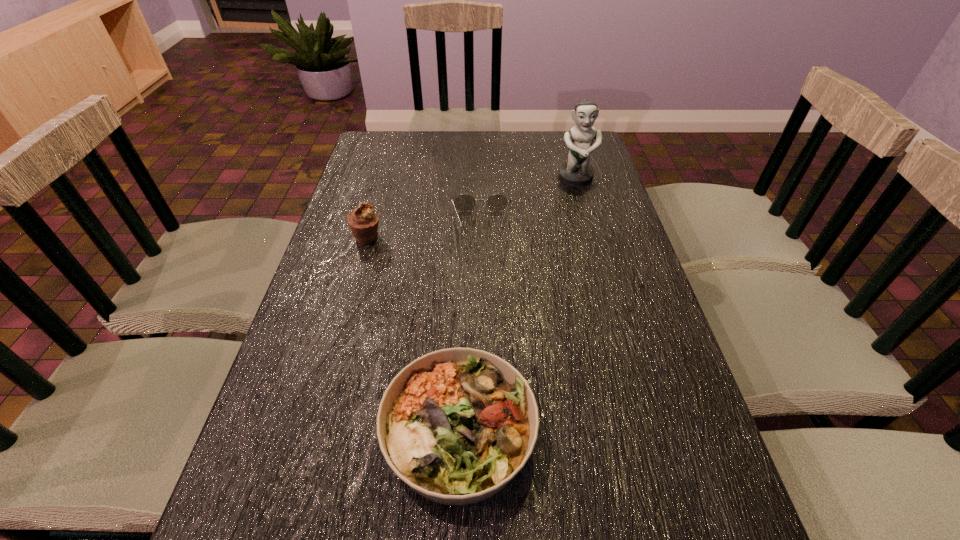
Locate an element on the screen. the farthest object is located at coordinates (577, 172).

The image size is (960, 540). I want to click on the rightmost object, so click(x=577, y=172).

At what (x,y) coordinates should I click in order to perform the action: click on the leftmost object. Please return your answer as a coordinate pair (x, y). The width and height of the screenshot is (960, 540). Looking at the image, I should click on tap(363, 221).

The image size is (960, 540). I want to click on muffin, so click(x=363, y=221).

Where is `salad plate`? The width and height of the screenshot is (960, 540). salad plate is located at coordinates (457, 424).

Where is `the second shortest object`? The image size is (960, 540). the second shortest object is located at coordinates (457, 424).

Locate an element on the screen. the shortest object is located at coordinates (497, 202).

Find the location of a particular element. free region located on the front-facing side of the rightmost object is located at coordinates (591, 233).

The height and width of the screenshot is (540, 960). Identify the location of vacant space located 0.050m on the right of the third shortest object. (400, 237).

I want to click on vacant space located 0.220m on the right of the salad plate, so click(x=655, y=434).